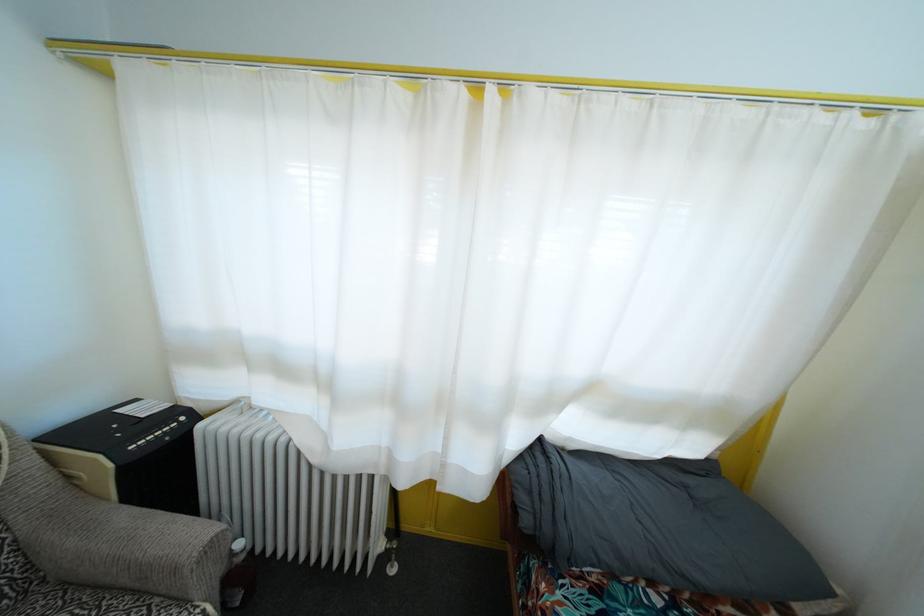
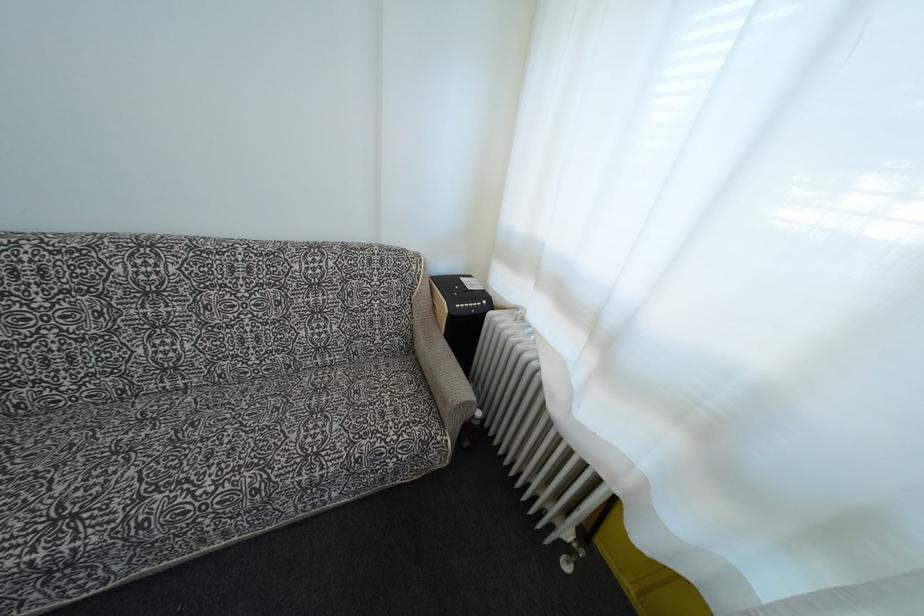
Find the pixel in the second image that matches the point at 246,564 in the first image.

(480, 429)